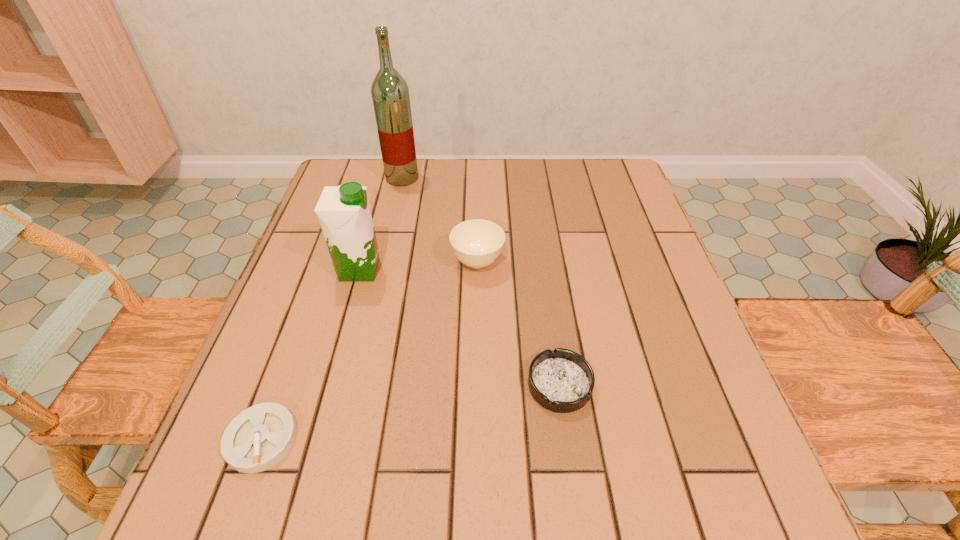
The image size is (960, 540). In order to click on the tallest object in this screenshot , I will do `click(390, 93)`.

You are a GUI agent. You are given a task and a screenshot of the screen. Output one action in this format:
    pyautogui.click(x=<x>, y=<y>)
    Task: Click on the liquor
    This screenshot has width=960, height=540.
    Given the screenshot: What is the action you would take?
    pyautogui.click(x=390, y=93)

The height and width of the screenshot is (540, 960). Identify the location of the fourth shortest object. (344, 213).

Find the location of a particular element. sugar bowl is located at coordinates (477, 243).

Locate an element on the screen. This screenshot has height=540, width=960. the fourth object from left to right is located at coordinates (477, 243).

Locate an element on the screen. Image resolution: width=960 pixels, height=540 pixels. the rightmost object is located at coordinates (562, 381).

At what (x,y) coordinates should I click in order to perform the action: click on the left ashtray. Please return your answer as a coordinate pair (x, y). The image size is (960, 540). Looking at the image, I should click on (258, 438).

Locate an element on the screen. free location located on the front of the farthest object is located at coordinates tap(384, 257).

Locate an element on the screen. This screenshot has width=960, height=540. free point located on the front-facing side of the fourth shortest object is located at coordinates (435, 270).

Identify the location of free space located on the back of the third shortest object. (478, 229).